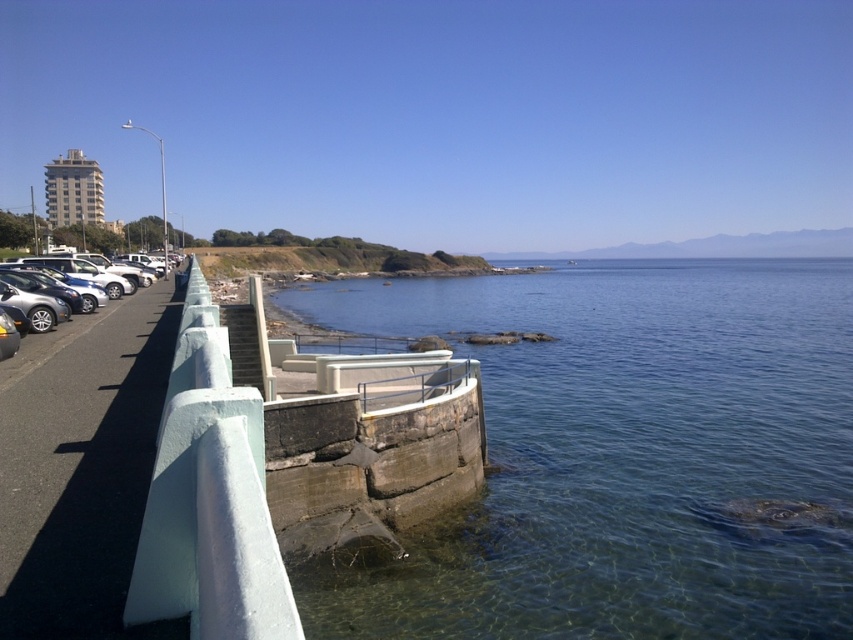
Is clear blue water at lower center further to camera compared to matte silver sedan at left?

Yes.

In the scene shown: Who is shorter, clear blue water at lower center or matte silver sedan at left?

With less height is matte silver sedan at left.

Is point (732, 456) farther from camera compared to point (38, 346)?

That is True.

This screenshot has height=640, width=853. I want to click on clear blue water at lower center, so click(x=624, y=456).